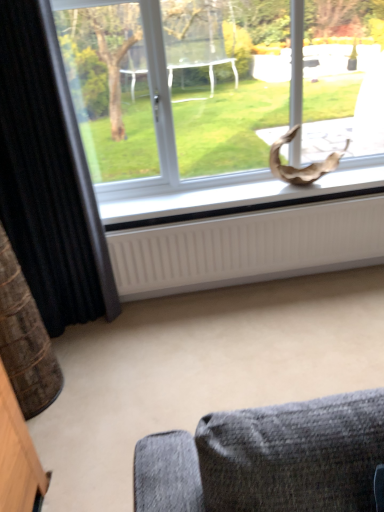
Where is `white matte window sill at center`? This screenshot has width=384, height=512. white matte window sill at center is located at coordinates (237, 199).

Describe the element at coordinates (47, 183) in the screenshot. I see `black textured curtain at left` at that location.

The width and height of the screenshot is (384, 512). Find the location of `white matte window sill at center`. white matte window sill at center is located at coordinates (237, 199).

From a real-world perspective, which is physically above, white ribbed radiator at lower center or black textured curtain at left?

black textured curtain at left is physically above.

Is point (312, 224) positioned in front of point (58, 307)?

No, (312, 224) is further to viewer.

Is white ribbed radiator at lower center looking in the opposite direction of black textured curtain at left?

white ribbed radiator at lower center does not have its back to black textured curtain at left.

From their relative heights in the image, would you say white ribbed radiator at lower center is taller or shorter than white matte window sill at center?

white ribbed radiator at lower center is taller than white matte window sill at center.

Which of these two, white ribbed radiator at lower center or white matte window sill at center, is thinner?

white ribbed radiator at lower center.

Looking at this image, is white ribbed radiator at lower center not close to white matte window sill at center?

white ribbed radiator at lower center is near white matte window sill at center, not far away.

Identify the location of curtain in front of the white matte window sill at center. (47, 183).

Is black textured curtain at left at the back of white matte window sill at center?

No, white matte window sill at center is not facing away from black textured curtain at left.

From a real-world perspective, is white matte window sill at center over black textured curtain at left?

Actually, white matte window sill at center is physically below black textured curtain at left in the real world.

Is black textured curtain at left inside white matte window sill at center?

Actually, black textured curtain at left is outside white matte window sill at center.

Is white matte window sill at center positioned with its back to white ribbed radiator at lower center?

No, white matte window sill at center is not facing away from white ribbed radiator at lower center.

Is white matte window sill at center inside or outside of white ribbed radiator at lower center?

The correct answer is: outside.

In the scene shown: Measure the distance from white matte window sill at center to white ribbed radiator at lower center.

The distance of white matte window sill at center from white ribbed radiator at lower center is 7.66 inches.

Looking at this image, from the image's perspective, is white matte window sill at center on white ribbed radiator at lower center?

Correct, white matte window sill at center appears higher than white ribbed radiator at lower center in the image.

Is black textured curtain at left turned away from white ribbed radiator at lower center?

black textured curtain at left does not have its back to white ribbed radiator at lower center.

Is point (36, 33) behind point (321, 241)?

No, it is not.

Is black textured curtain at left closer to the viewer compared to white ribbed radiator at lower center?

Yes.

Is black textured curtain at left wider or thinner than white ribbed radiator at lower center?

black textured curtain at left is wider than white ribbed radiator at lower center.

Is transparent glass window at upper center facing away from white matte window sill at center?

No, transparent glass window at upper center is not facing away from white matte window sill at center.

Would you say transparent glass window at upper center is outside white matte window sill at center?

Yes, transparent glass window at upper center is located beyond the bounds of white matte window sill at center.

Based on their positions, is transparent glass window at upper center located to the left or right of white matte window sill at center?

transparent glass window at upper center is positioned on white matte window sill at center's left side.

Is transparent glass window at upper center far away from white matte window sill at center?

They are positioned close to each other.

Can you confirm if black textured curtain at left is wider than transparent glass window at upper center?

No, black textured curtain at left is not wider than transparent glass window at upper center.

Is black textured curtain at left placed right next to transparent glass window at upper center?

black textured curtain at left is not next to transparent glass window at upper center, and they're not touching.

Is black textured curtain at left aimed at transparent glass window at upper center?

No.

Is point (29, 34) closer to camera compared to point (162, 79)?

Yes, it is.

This screenshot has width=384, height=512. I want to click on radiator below the black textured curtain at left (from a real-world perspective), so click(x=247, y=247).

Identify the location of radiator in front of the white matte window sill at center. Image resolution: width=384 pixels, height=512 pixels. (247, 247).

Estimate the real-world distances between objects in this image. Which object is closer to white matte window sill at center, transparent glass window at upper center or white ribbed radiator at lower center?

The object closer to white matte window sill at center is white ribbed radiator at lower center.

Considering their positions, is white ribbed radiator at lower center positioned further to transparent glass window at upper center than white matte window sill at center?

The object further to transparent glass window at upper center is white ribbed radiator at lower center.

Looking at the image, which one is located closer to black textured curtain at left, transparent glass window at upper center or white matte window sill at center?

The object closer to black textured curtain at left is white matte window sill at center.

From the image, which object appears to be farther from black textured curtain at left, white ribbed radiator at lower center or white matte window sill at center?

white ribbed radiator at lower center is further to black textured curtain at left.

Consider the image. When comparing their distances from transparent glass window at upper center, does white ribbed radiator at lower center or black textured curtain at left seem closer?

Based on the image, white ribbed radiator at lower center appears to be nearer to transparent glass window at upper center.

Based on their spatial positions, is white ribbed radiator at lower center or transparent glass window at upper center closer to white matte window sill at center?

Based on the image, white ribbed radiator at lower center appears to be nearer to white matte window sill at center.

Considering their positions, is transparent glass window at upper center positioned closer to black textured curtain at left than white ribbed radiator at lower center?

white ribbed radiator at lower center is positioned closer to the anchor black textured curtain at left.

Based on their spatial positions, is black textured curtain at left or transparent glass window at upper center closer to white matte window sill at center?

The object closer to white matte window sill at center is transparent glass window at upper center.

The image size is (384, 512). Find the location of `radiator between black textured curtain at left and transparent glass window at upper center in the horizontal direction`. radiator between black textured curtain at left and transparent glass window at upper center in the horizontal direction is located at coordinates (247, 247).

Locate an element on the screen. The height and width of the screenshot is (512, 384). window between black textured curtain at left and white matte window sill at center in the horizontal direction is located at coordinates (203, 104).

Identify the location of window sill between transparent glass window at upper center and white ribbed radiator at lower center in the up-down direction. This screenshot has height=512, width=384. (237, 199).

At what (x,y) coordinates should I click in order to perform the action: click on radiator between black textured curtain at left and white matte window sill at center in the horizontal direction. Please return your answer as a coordinate pair (x, y). This screenshot has width=384, height=512. Looking at the image, I should click on (247, 247).